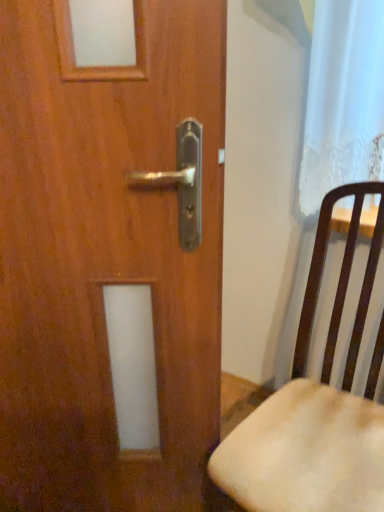
Question: Can we say wooden chair at right lies outside wooden door at center?

Choices:
 (A) yes
 (B) no

Answer: (A)

Question: Can you confirm if wooden chair at right is thinner than wooden door at center?

Choices:
 (A) no
 (B) yes

Answer: (A)

Question: From a real-world perspective, is wooden chair at right over wooden door at center?

Choices:
 (A) yes
 (B) no

Answer: (B)

Question: Is wooden door at center a part of wooden chair at right?

Choices:
 (A) yes
 (B) no

Answer: (B)

Question: Is wooden chair at right far away from wooden door at center?

Choices:
 (A) no
 (B) yes

Answer: (A)

Question: Does wooden chair at right have a greater height compared to wooden door at center?

Choices:
 (A) no
 (B) yes

Answer: (A)

Question: Is wooden door at center turned away from wooden chair at right?

Choices:
 (A) no
 (B) yes

Answer: (A)

Question: Does wooden door at center have a greater width compared to wooden chair at right?

Choices:
 (A) no
 (B) yes

Answer: (A)

Question: Is wooden door at center far away from wooden chair at right?

Choices:
 (A) no
 (B) yes

Answer: (A)

Question: Is wooden door at center thinner than wooden chair at right?

Choices:
 (A) yes
 (B) no

Answer: (A)

Question: From the image's perspective, does wooden door at center appear lower than wooden chair at right?

Choices:
 (A) no
 (B) yes

Answer: (A)

Question: Considering the relative positions of wooden door at center and wooden chair at right in the image provided, is wooden door at center to the right of wooden chair at right from the viewer's perspective?

Choices:
 (A) yes
 (B) no

Answer: (B)

Question: Considering the relative positions of wooden door at center and wooden chair at right in the image provided, is wooden door at center to the left or to the right of wooden chair at right?

Choices:
 (A) right
 (B) left

Answer: (B)